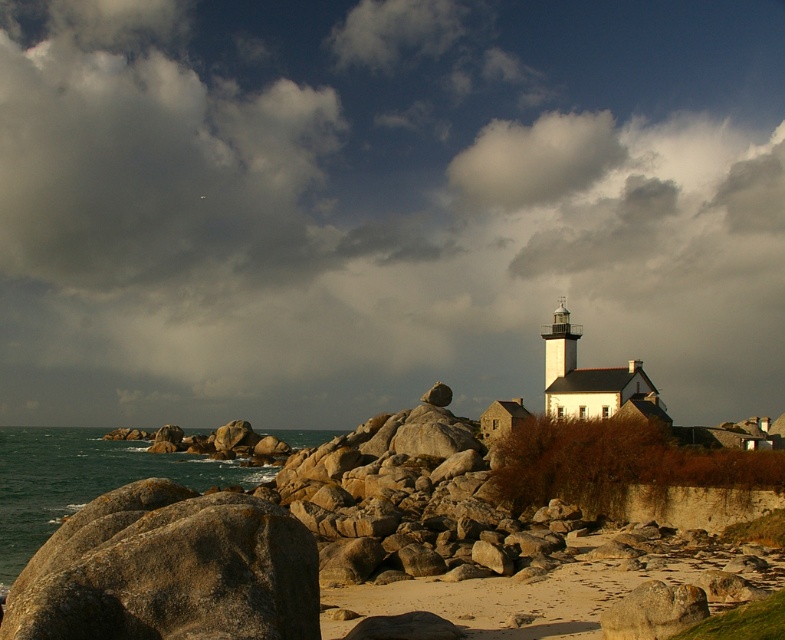
Does cloudy sky at upper center have a lesser width compared to brown rough rock at lower left?

No.

Between point (605, 305) and point (203, 612), which one is positioned in front?

Point (203, 612) is in front.

Identify the location of cloudy sky at upper center. The image size is (785, 640). (382, 204).

Between cloudy sky at upper center and greenish-blue water at lower left, which one has less height?

greenish-blue water at lower left

This screenshot has width=785, height=640. What do you see at coordinates (382, 204) in the screenshot? I see `cloudy sky at upper center` at bounding box center [382, 204].

The image size is (785, 640). I want to click on cloudy sky at upper center, so click(x=382, y=204).

Who is shorter, brown rough rock at lower left or greenish-blue water at lower left?

Standing shorter between the two is brown rough rock at lower left.

Which is in front, point (159, 620) or point (19, 541)?

Point (159, 620) is more forward.

Is point (287, 516) more distant than point (46, 524)?

No, (287, 516) is closer to viewer.

Identify the location of brown rough rock at lower left. (184, 580).